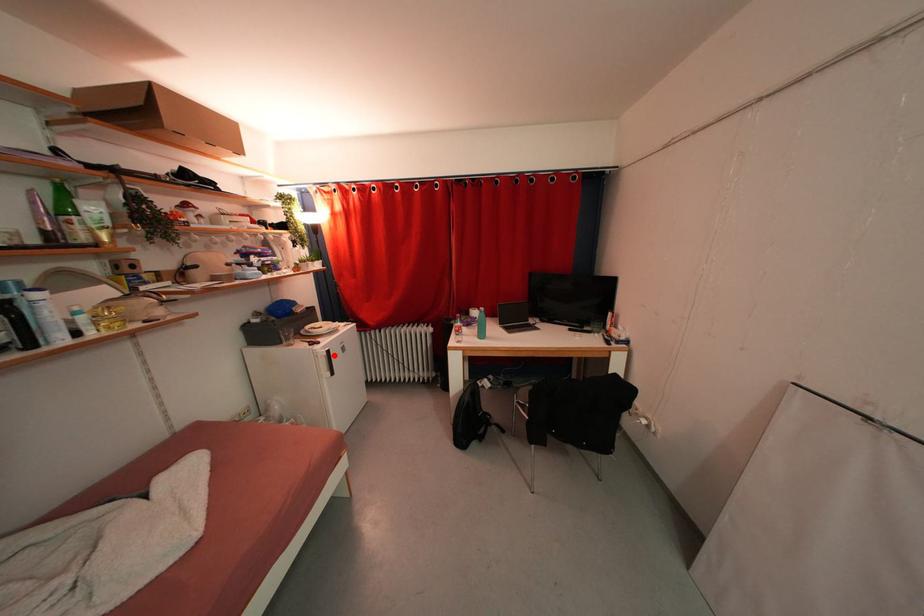
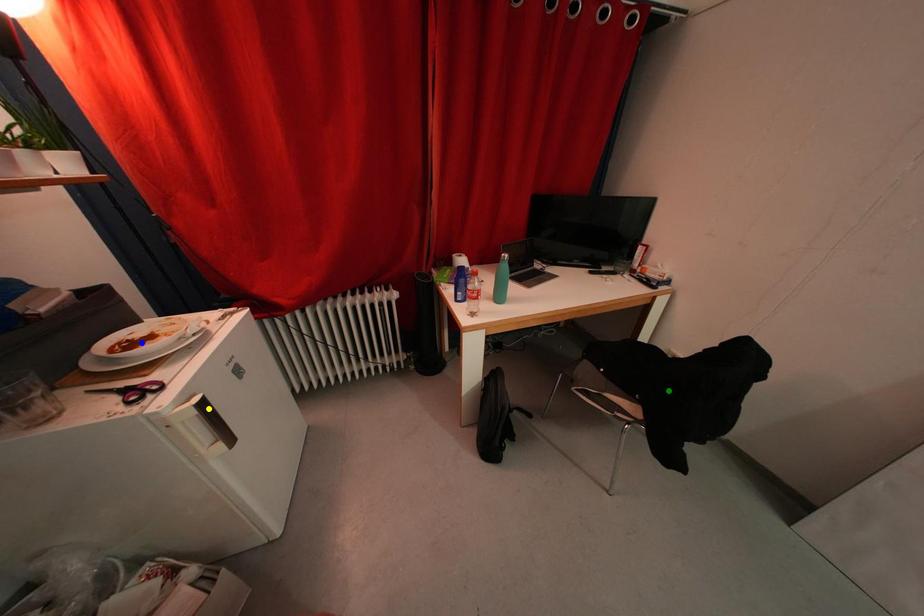
Question: I am providing you with two images of the same scene from different viewpoints. A red point is marked on the first image. You are given multiple points on the second image. Which spot in image 2 lines up with the point in image 1?

Choices:
 (A) blue point
 (B) yellow point
 (C) green point

Answer: (B)